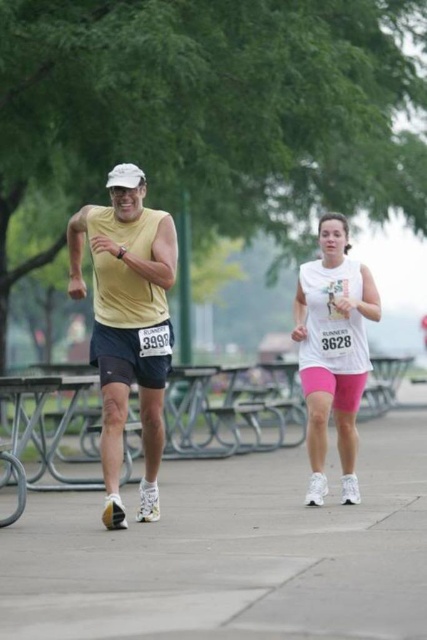
Who is taller, gray concrete pavement at center or yellow matte tank top at left?

yellow matte tank top at left is taller.

Which is more to the left, gray concrete pavement at center or yellow matte tank top at left?

yellow matte tank top at left

What do you see at coordinates (233, 552) in the screenshot? I see `gray concrete pavement at center` at bounding box center [233, 552].

This screenshot has width=427, height=640. Find the location of `gray concrete pavement at center`. gray concrete pavement at center is located at coordinates (233, 552).

Can you confirm if gray concrete pavement at center is taller than white matte tank top at center?

Incorrect, gray concrete pavement at center's height is not larger of white matte tank top at center's.

Is point (87, 541) more distant than point (336, 339)?

No, it is not.

Who is more forward, (286, 593) or (350, 307)?

Point (286, 593)

Find the location of a particular element. gray concrete pavement at center is located at coordinates (233, 552).

Which of these two, yellow matte tank top at left or white matte tank top at center, stands taller?

Standing taller between the two is yellow matte tank top at left.

Can you confirm if yellow matte tank top at left is wider than white matte tank top at center?

Indeed, yellow matte tank top at left has a greater width compared to white matte tank top at center.

What do you see at coordinates (128, 323) in the screenshot?
I see `yellow matte tank top at left` at bounding box center [128, 323].

Where is `yellow matte tank top at left`? This screenshot has height=640, width=427. yellow matte tank top at left is located at coordinates (128, 323).